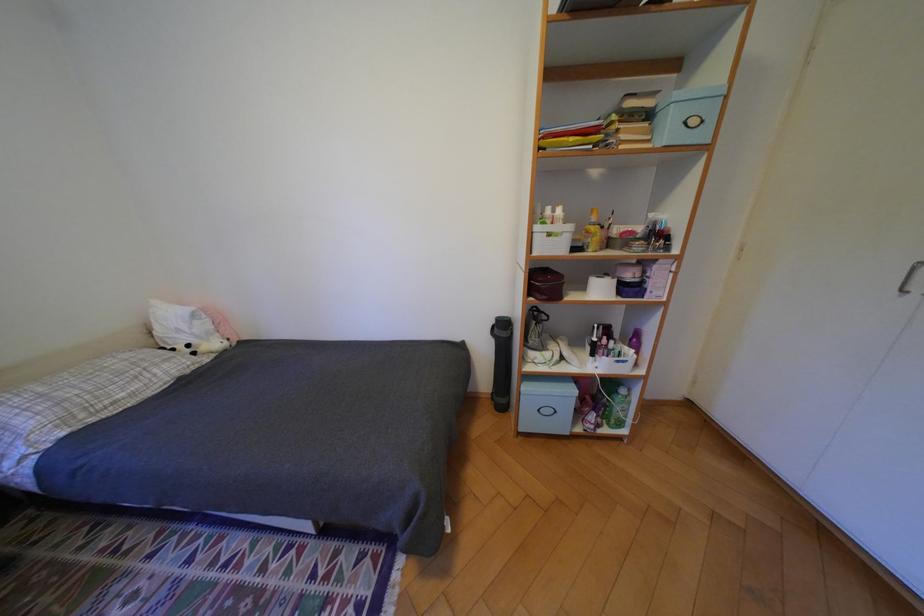
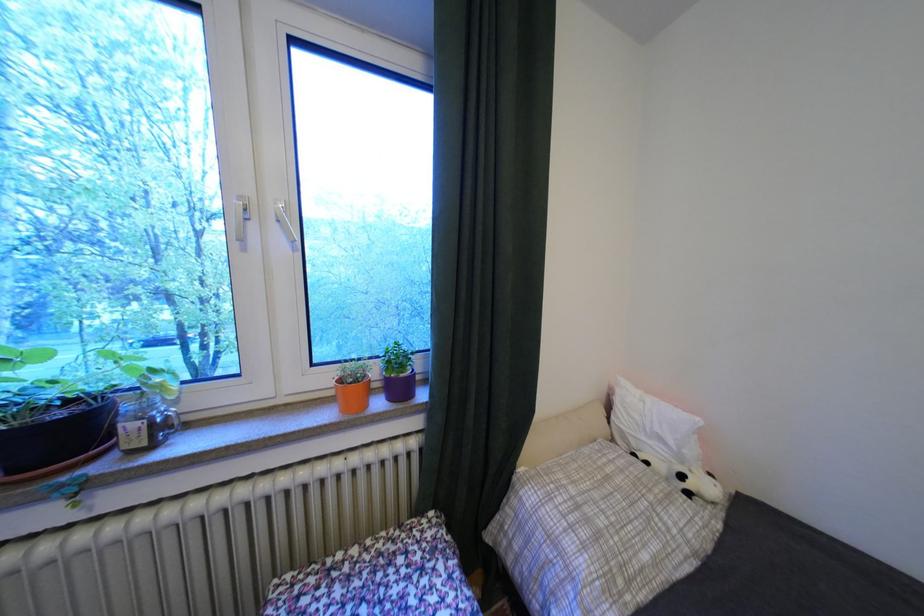
In the second image, find the point that corresponds to the point at 144,395 in the first image.

(667, 562)